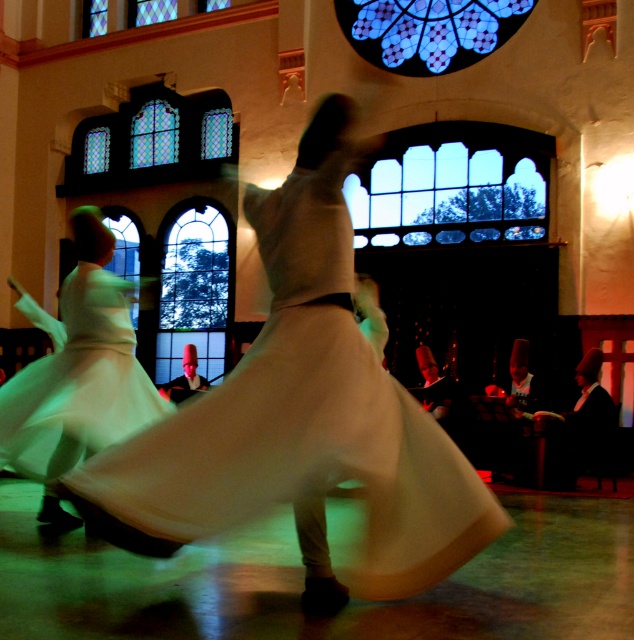
Can you confirm if stained glass window at upper left is thinner than blue stained glass at upper center?

Incorrect, stained glass window at upper left's width is not less than blue stained glass at upper center's.

Is point (221, 148) positioned before point (456, 48)?

That is False.

Find the location of `stained glass window at upper left`. stained glass window at upper left is located at coordinates (152, 141).

Who is higher up, blue stained glass at upper center or transparent stained glass at center?

blue stained glass at upper center

Does point (396, 10) come in front of point (210, 230)?

Yes, it is in front of point (210, 230).

Measure the distance between blue stained glass at upper center and camera.

The distance of blue stained glass at upper center from camera is 120.43 feet.

Where is `blue stained glass at upper center`? The width and height of the screenshot is (634, 640). blue stained glass at upper center is located at coordinates (429, 29).

Looking at this image, which is more to the right, white cotton dress at center or blue stained glass at upper center?

blue stained glass at upper center

In the scene shown: Is white cotton dress at center below blue stained glass at upper center?

Yes, white cotton dress at center is below blue stained glass at upper center.

Does point (420, 417) lie in front of point (373, 42)?

Yes, point (420, 417) is closer to viewer.

At what (x,y) coordinates should I click in order to perform the action: click on white cotton dress at center. Please return your answer as a coordinate pair (x, y). Looking at the image, I should click on (304, 420).